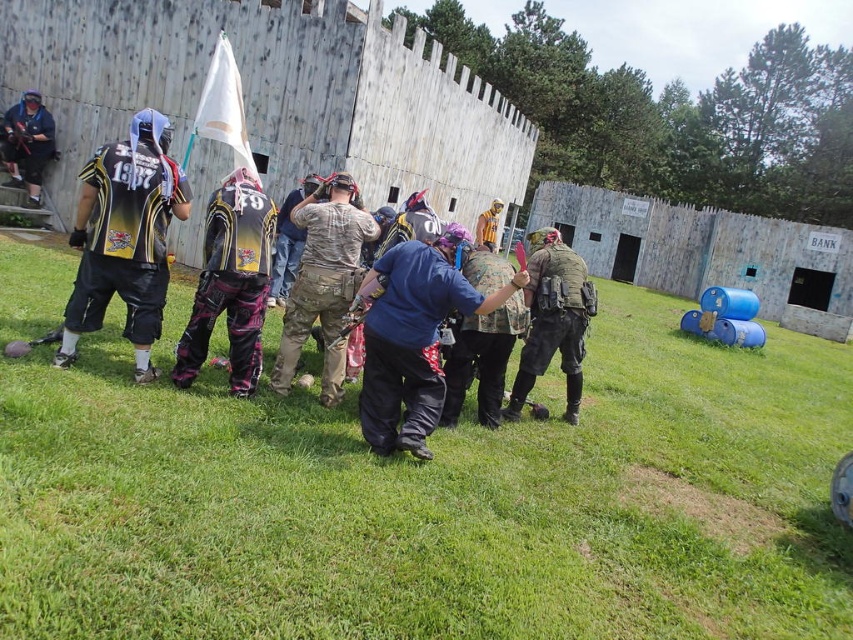
Which is in front, point (396, 282) or point (316, 300)?

Positioned in front is point (396, 282).

Between point (428, 429) and point (289, 314), which one is positioned behind?

Positioned behind is point (289, 314).

Measure the distance between blue matte shirt at center and camera.

3.90 meters

Identify the location of blue matte shirt at center. The width and height of the screenshot is (853, 640). (413, 337).

In the scene shown: Is green grass at center above matte black jacket at upper left?

Actually, green grass at center is below matte black jacket at upper left.

Can you confirm if green grass at center is bigger than matte black jacket at upper left?

Correct, green grass at center is larger in size than matte black jacket at upper left.

Which is behind, point (30, 304) or point (12, 157)?

The point (12, 157) is more distant.

The image size is (853, 640). What are the coordinates of `green grass at center` in the screenshot? It's located at (434, 500).

This screenshot has width=853, height=640. What do you see at coordinates (434, 500) in the screenshot?
I see `green grass at center` at bounding box center [434, 500].

Who is more distant from viewer, (x=128, y=600) or (x=219, y=291)?

The point (x=219, y=291) is more distant.

I want to click on green grass at center, so click(434, 500).